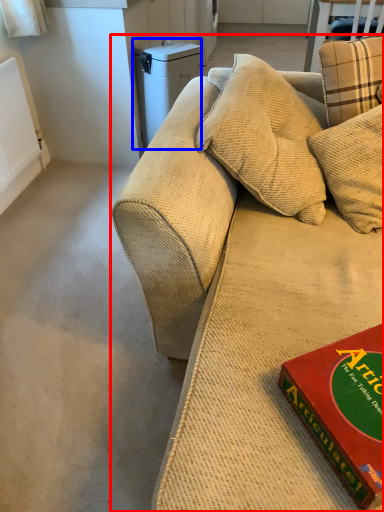
Question: Which point is closer to the camera, studio couch (highlighted by a red box) or appliance (highlighted by a blue box)?

Choices:
 (A) studio couch
 (B) appliance

Answer: (A)